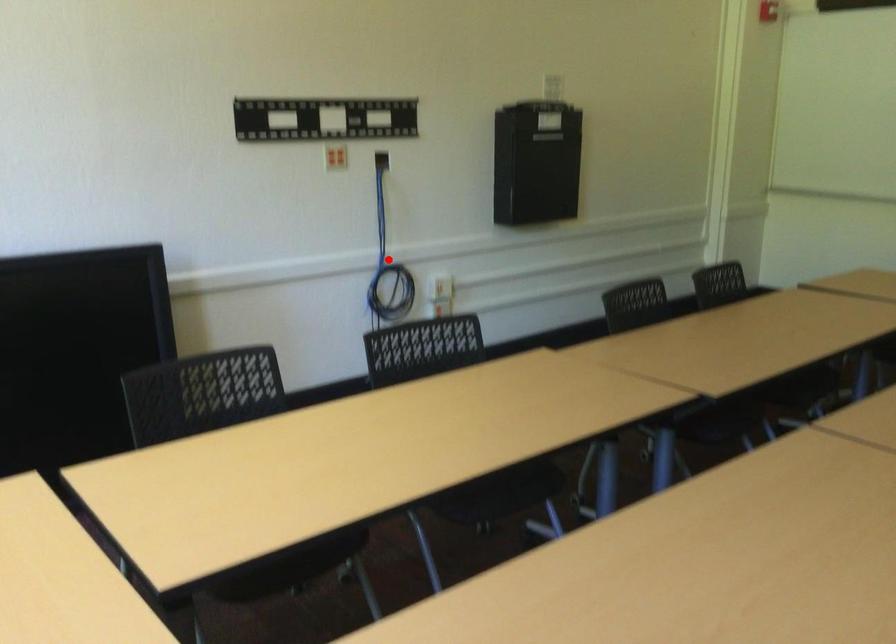
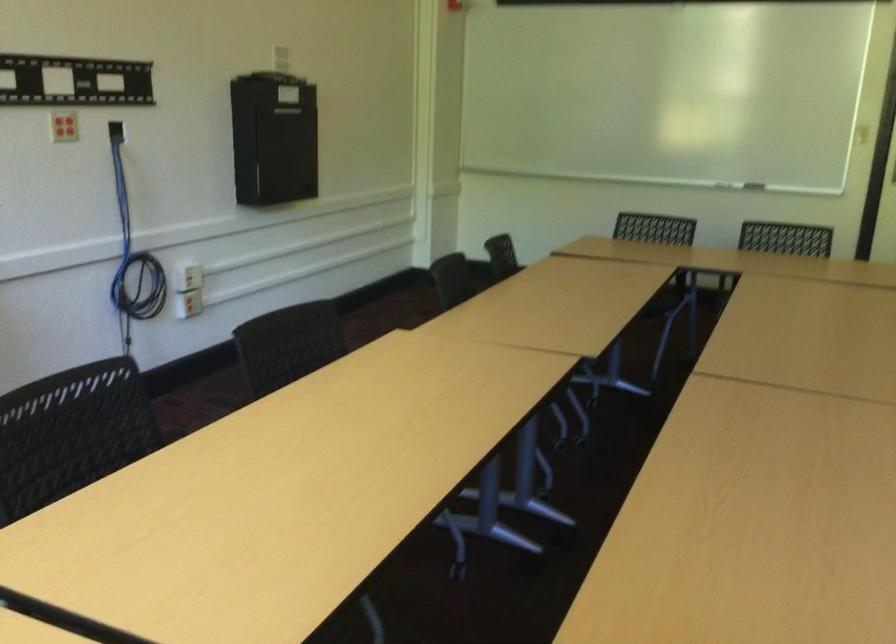
Where in the second image is the point corresponding to the highlighted location from the first image?

(133, 252)